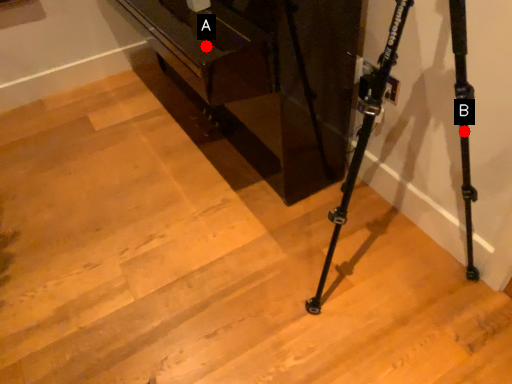
Question: Two points are circled on the image, labeled by A and B beside each circle. Which point appears closest to the camera in this image?

Choices:
 (A) A is closer
 (B) B is closer

Answer: (B)